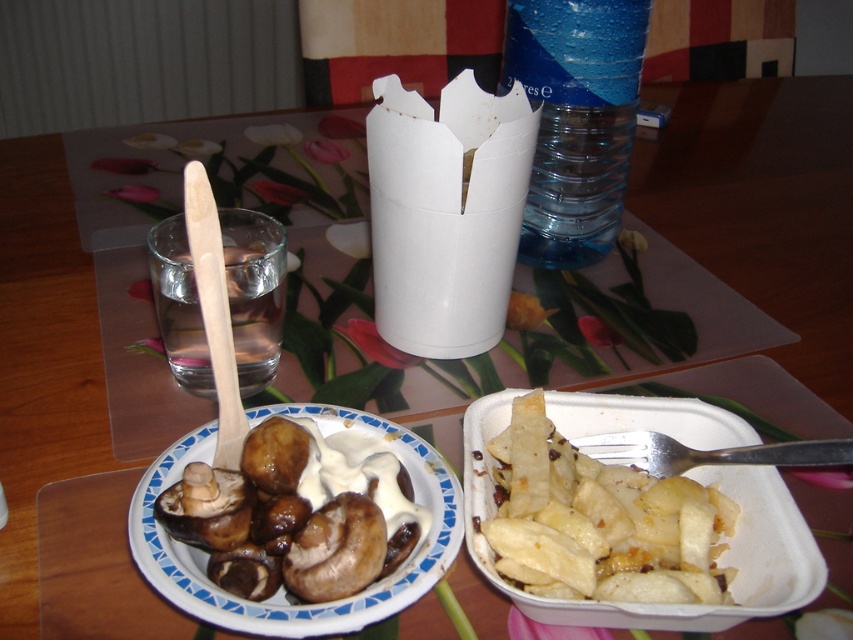
In the scene shown: You are a food delivery person who needs to stack the brown glossy mushrooms at left and white matte potato wedges at lower right into a single box. Which item should be placed at the bottom to prevent the taller one from toppling over?

The white matte potato wedges at lower right are taller than the brown glossy mushrooms at left, so place the brown glossy mushrooms at left at the bottom to prevent the taller potato wedges from toppling over.

You are organizing the items on the table and need to know which item takes up more space. Which one is larger in size between the brown glossy mushrooms at left and the blue plastic bottle at upper center?

The blue plastic bottle at upper center occupies more space than the brown glossy mushrooms at left.